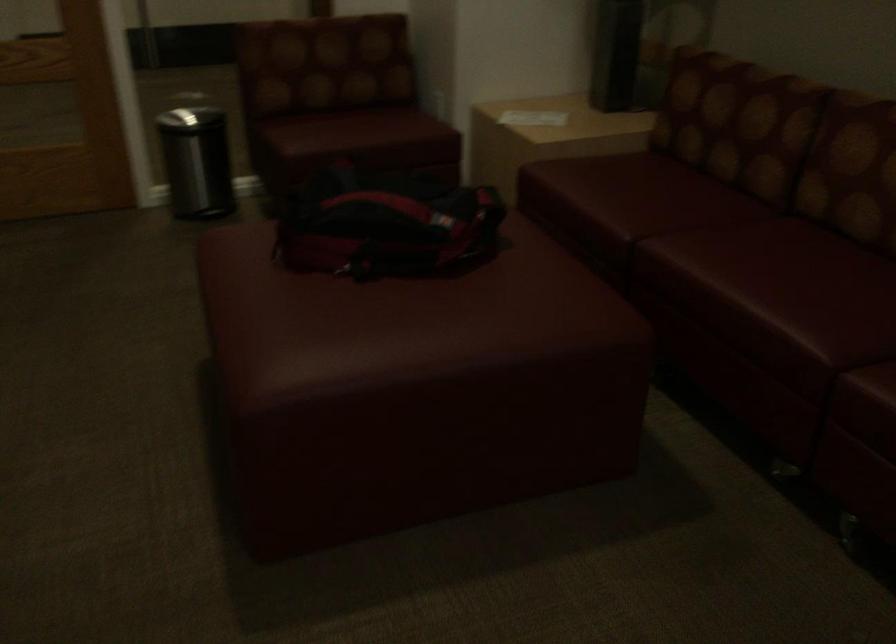
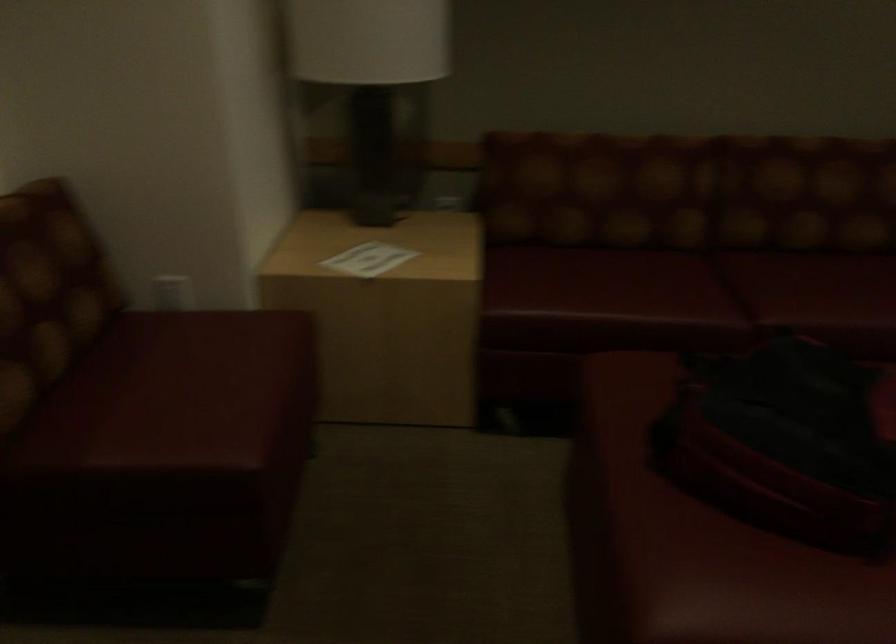
The point at (x=328, y=198) is marked in the first image. Where is the corresponding point in the second image?

(786, 442)